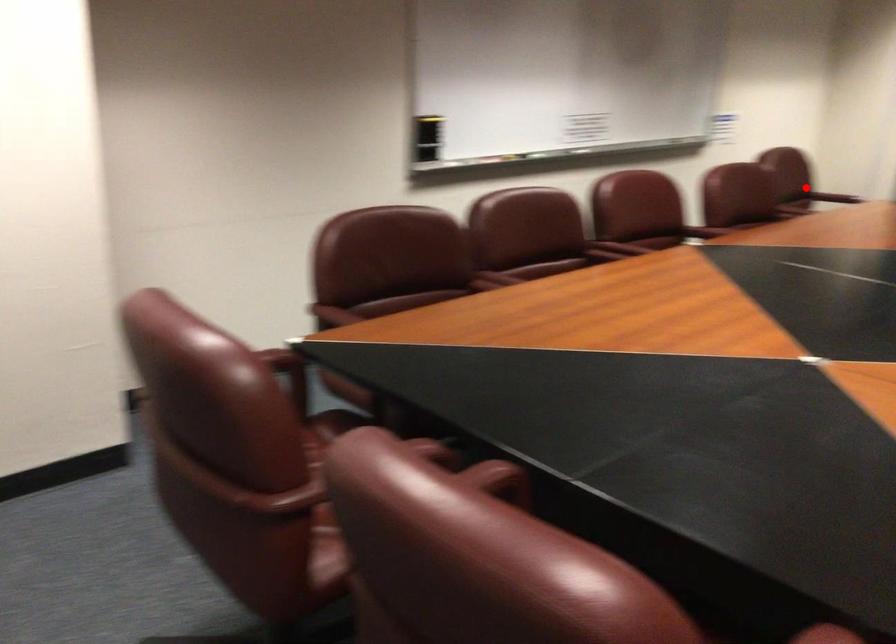
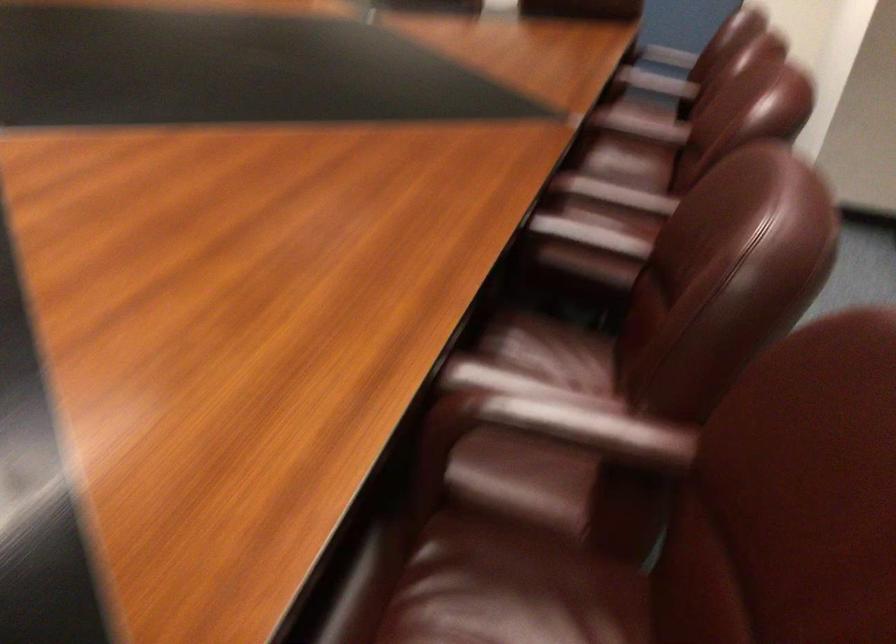
Locate, in the second image, the point that corresponds to the highlighted location in the first image.

(532, 420)